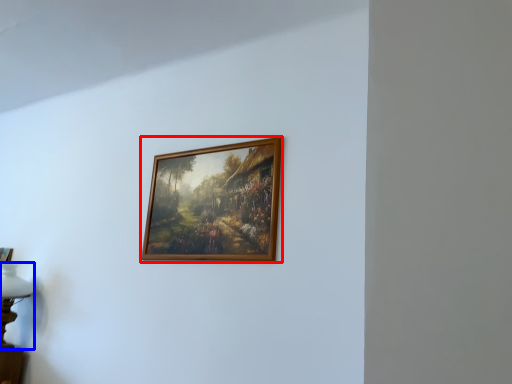
Question: Which object appears farthest to the camera in this image, picture frame (highlighted by a red box) or table lamp (highlighted by a blue box)?

Choices:
 (A) picture frame
 (B) table lamp

Answer: (B)